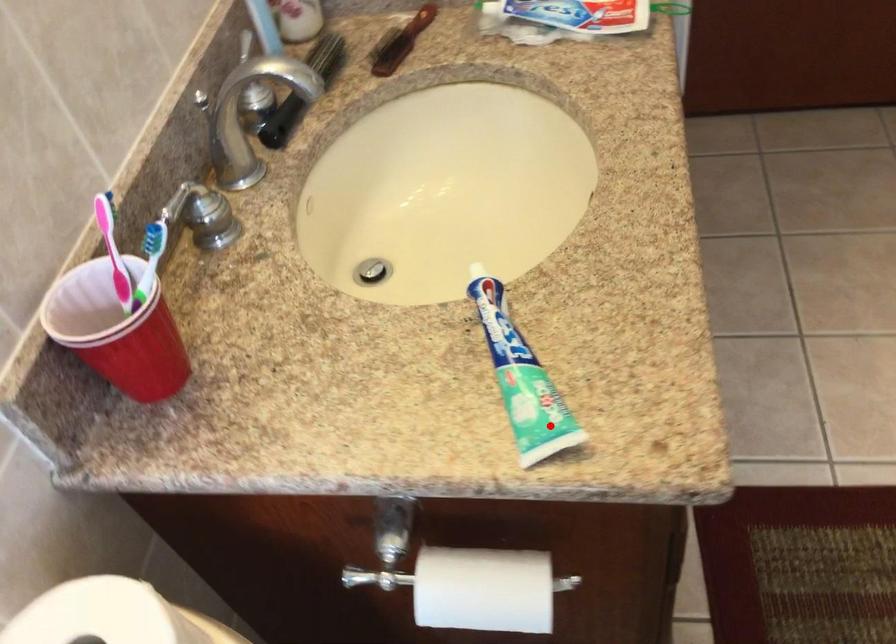
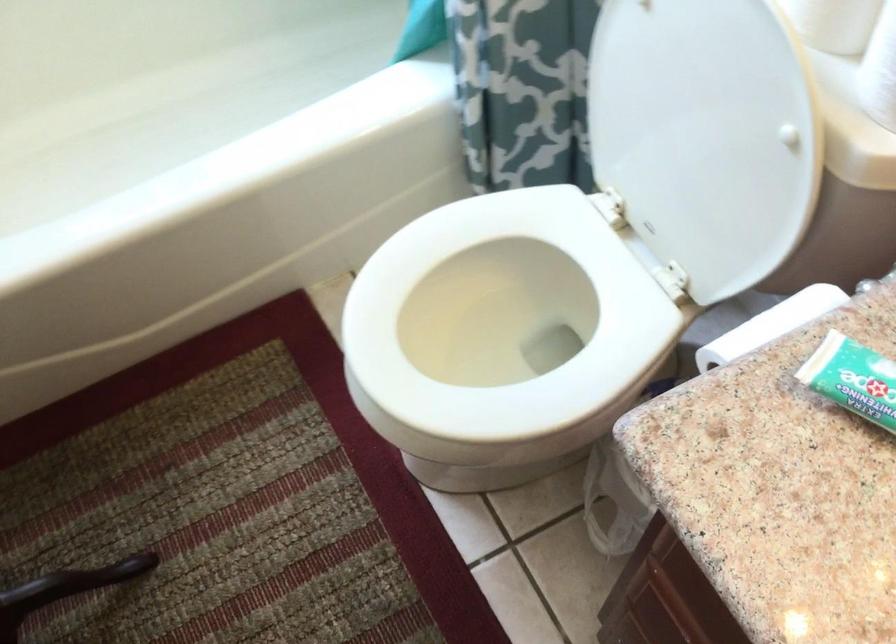
Question: I am providing you with two images of the same scene from different viewpoints. A red point is marked on the first image. At the location where the point appears in image 1, is it still visible in image 2?

Choices:
 (A) Yes
 (B) No

Answer: (A)